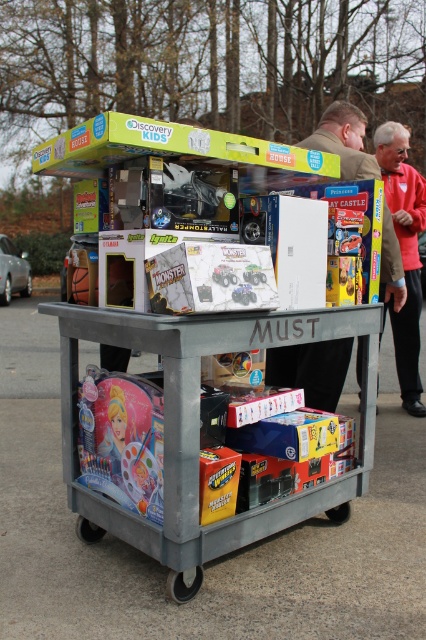
Is point (411, 214) in front of point (118, 449)?

No, it is behind (118, 449).

Between red jacket at upper right and matte pink princess doll at lower left, which one has less height?

matte pink princess doll at lower left

Between point (420, 189) and point (117, 433), which one is positioned in front?

Point (117, 433) is in front.

Where is `red jacket at upper right`? Image resolution: width=426 pixels, height=640 pixels. red jacket at upper right is located at coordinates (405, 253).

Consider the image. Can you confirm if brown leather jacket at upper right is wider than red jacket at upper right?

Indeed, brown leather jacket at upper right has a greater width compared to red jacket at upper right.

Locate an element on the screen. brown leather jacket at upper right is located at coordinates (311, 369).

Find the location of a particular element. This screenshot has width=426, height=640. brown leather jacket at upper right is located at coordinates (311, 369).

Is point (305, 396) positioned before point (213, 276)?

No, (305, 396) is behind (213, 276).

Who is lower down, brown leather jacket at upper right or matte black monster truck at center?

matte black monster truck at center is lower down.

Does point (385, 208) lie in front of point (227, 268)?

No, (385, 208) is further to viewer.

I want to click on brown leather jacket at upper right, so click(x=311, y=369).